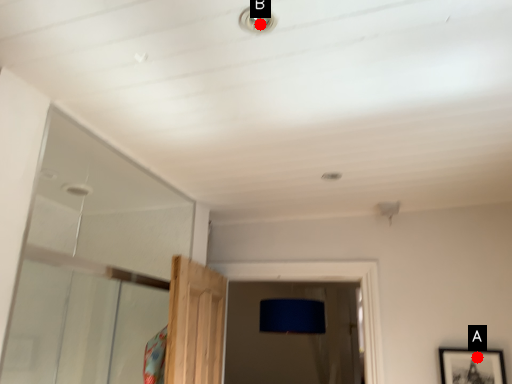
Question: Two points are circled on the image, labeled by A and B beside each circle. Which point appears farthest from the camera in this image?

Choices:
 (A) A is further
 (B) B is further

Answer: (A)